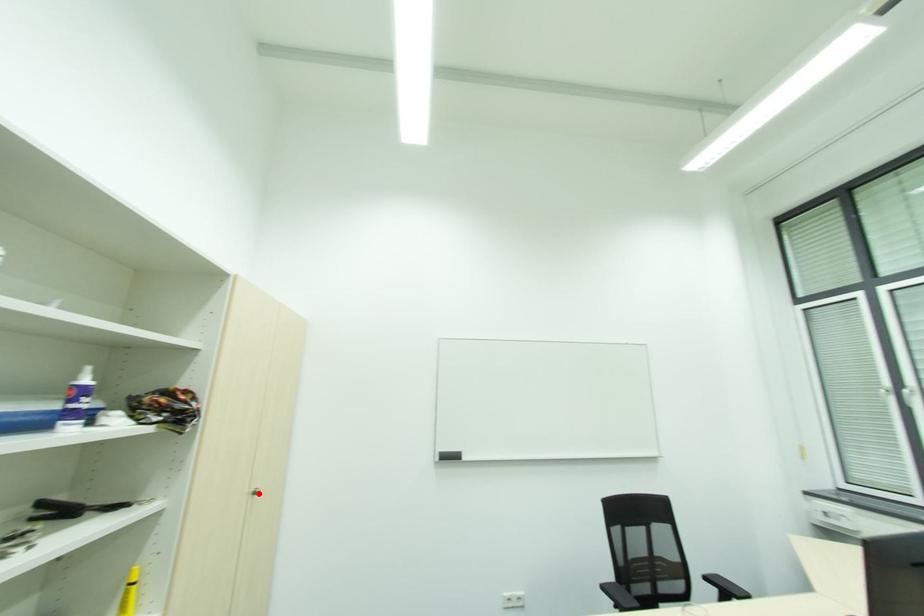
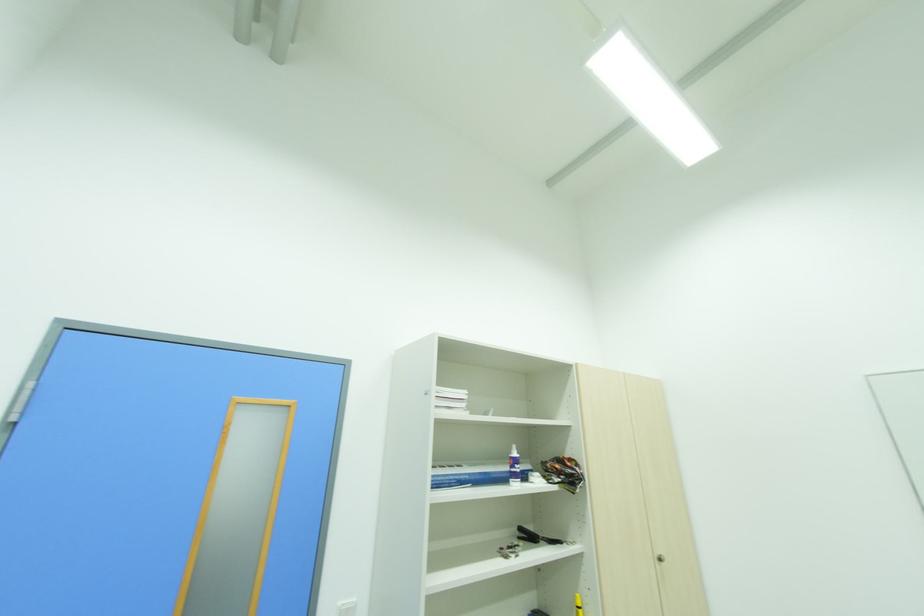
Locate, in the second image, the point that corresponds to the highlighted location in the first image.

(663, 561)